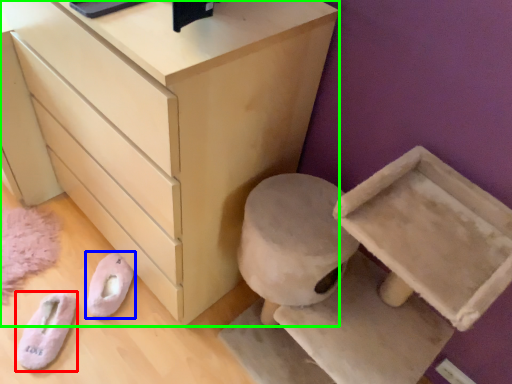
Question: Which object is positioned farthest from footwear (highlighted by a red box)? Select from footwear (highlighted by a blue box) and chest of drawers (highlighted by a green box).

Choices:
 (A) footwear
 (B) chest of drawers

Answer: (B)